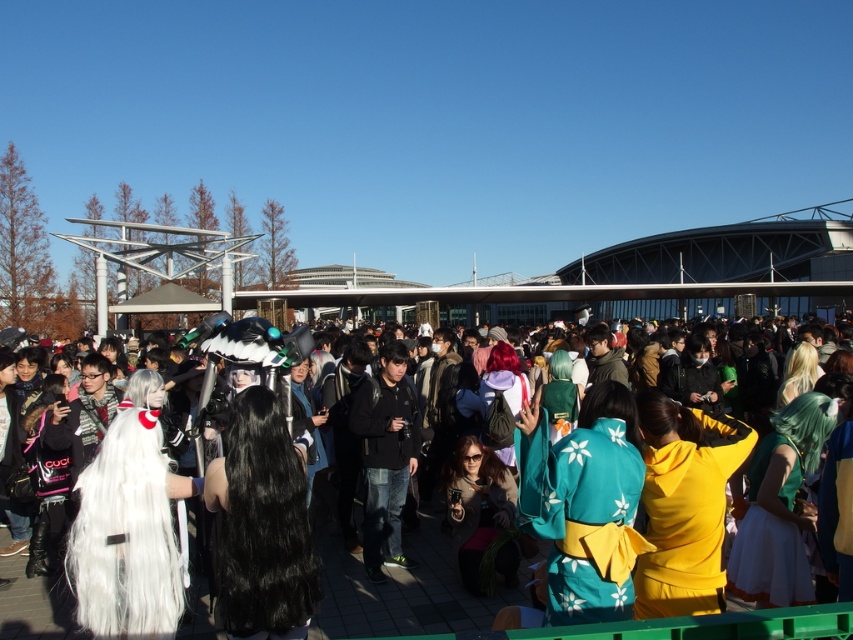
Looking at this image, you are standing in the crowd at the event and want to take a photo of the point at coordinates (143, 628). Considering the distance, can you reach that point to take the photo?

The point at coordinates (143, 628) is 21.95 meters away from the viewer, so you cannot physically reach it to take the photo. You would need a zoom lens or a device with a telephoto capability to capture it from your current position.

You are at the event and want to take a photo of the yellow matte hoodie at center. If you are standing 22.93 meters away from it, is that a good distance for a clear photo?

The yellow matte hoodie at center is 22.93 meters away from you, so it might be too far to capture a clear photo without a zoom lens.

You are a photographer at the event and want to capture both the white fluffy wig at left and the green satin dress at center in a single photo. Given that your camera has a maximum focal length that allows capturing objects up to 20 meters apart, will you be able to include both subjects in the frame?

The white fluffy wig at left and the green satin dress at center are 20.83 meters apart, which exceeds the camera maximum focal length of 20 meters. Therefore, you won not be able to include both subjects in the frame.